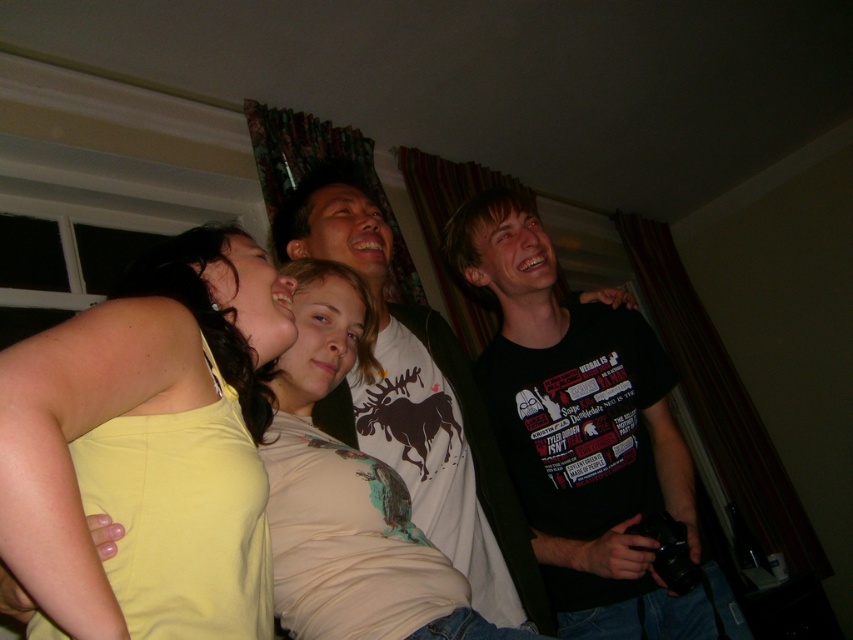
Question: Does black matte t-shirt at right appear on the right side of yellow fabric at left?

Choices:
 (A) no
 (B) yes

Answer: (B)

Question: Estimate the real-world distances between objects in this image. Which object is farther from the white matte t-shirt at center?

Choices:
 (A) black matte t-shirt at right
 (B) yellow fabric at left

Answer: (B)

Question: Which object is positioned closest to the black matte t-shirt at right?

Choices:
 (A) white matte t-shirt at center
 (B) yellow fabric at left

Answer: (A)

Question: Which point is farther to the camera?

Choices:
 (A) black matte t-shirt at right
 (B) white matte t-shirt at center

Answer: (A)

Question: Is black matte t-shirt at right to the left of yellow fabric at left from the viewer's perspective?

Choices:
 (A) yes
 (B) no

Answer: (B)

Question: Observing the image, what is the correct spatial positioning of black matte t-shirt at right in reference to yellow fabric at left?

Choices:
 (A) right
 (B) left

Answer: (A)